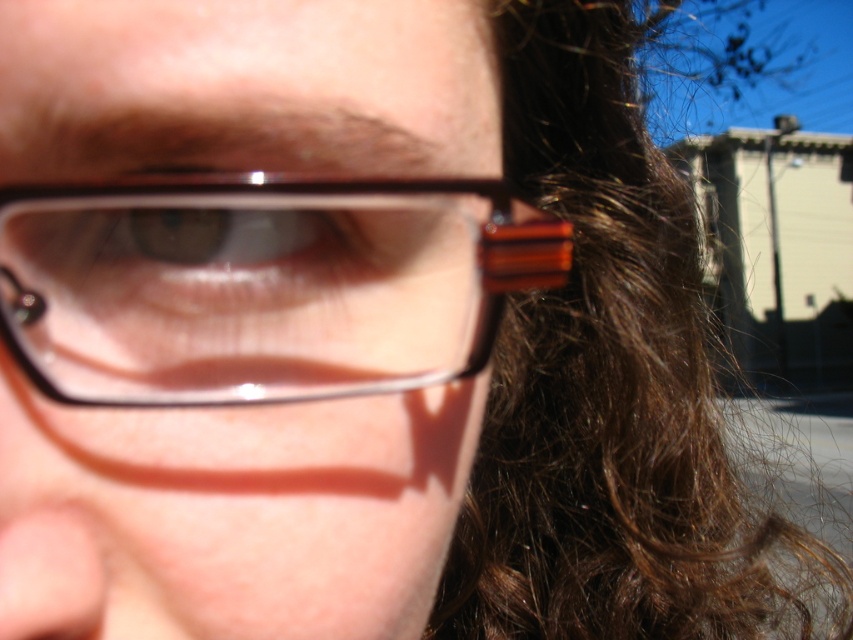
Is brown shiny hair at right thinner than brown glossy eye at center?

In fact, brown shiny hair at right might be wider than brown glossy eye at center.

Which is more to the left, brown shiny hair at right or brown glossy eye at center?

Positioned to the left is brown glossy eye at center.

Where is `brown shiny hair at right`? The height and width of the screenshot is (640, 853). brown shiny hair at right is located at coordinates (611, 388).

Image resolution: width=853 pixels, height=640 pixels. Find the location of `brown shiny hair at right`. brown shiny hair at right is located at coordinates (611, 388).

Identify the location of brown shiny hair at right. The image size is (853, 640). (611, 388).

How far apart are brown shiny hair at right and translucent plastic glasses at center?

brown shiny hair at right is 24.06 inches from translucent plastic glasses at center.

Is point (677, 344) more distant than point (149, 227)?

Yes.

Identify the location of brown shiny hair at right. The height and width of the screenshot is (640, 853). (611, 388).

Who is taller, translucent plastic glasses at center or brown glossy eye at center?

translucent plastic glasses at center

Between point (387, 257) and point (223, 253), which one is positioned behind?

The point (387, 257) is behind.

Where is `translucent plastic glasses at center`? translucent plastic glasses at center is located at coordinates (263, 285).